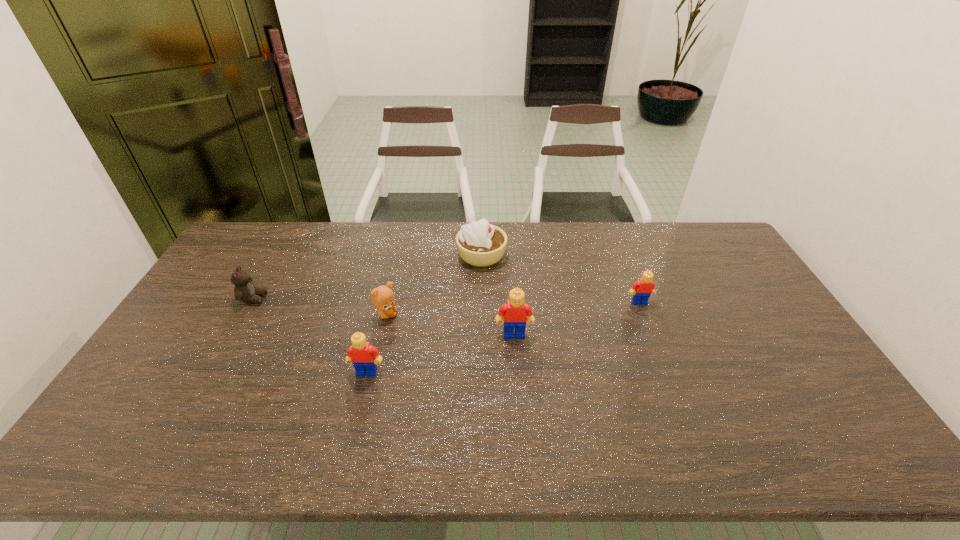
Locate an element on the screen. free area in between the left teddy bear and the whipped cream is located at coordinates (368, 276).

Where is `free area in between the left teddy bear and the rightmost Lego`? free area in between the left teddy bear and the rightmost Lego is located at coordinates (446, 300).

Where is `vacant space that's between the second nearest object and the leftmost Lego`? The width and height of the screenshot is (960, 540). vacant space that's between the second nearest object and the leftmost Lego is located at coordinates (441, 353).

Select which object is the third closest to the right teddy bear. Please provide its 2D coordinates. Your answer should be formatted as a tuple, i.e. [(x, y)], where the tuple contains the x and y coordinates of a point satisfying the conditions above.

[(515, 311)]

Point out which object is positioned as the nearest to the leftmost object. Please provide its 2D coordinates. Your answer should be formatted as a tuple, i.e. [(x, y)], where the tuple contains the x and y coordinates of a point satisfying the conditions above.

[(382, 297)]

You are a GUI agent. You are given a task and a screenshot of the screen. Output one action in this format:
    pyautogui.click(x=<x>, y=<y>)
    Task: Click on the Lego that is the nearest to the nearest object
    The width and height of the screenshot is (960, 540).
    Given the screenshot: What is the action you would take?
    pyautogui.click(x=515, y=311)

I want to click on Lego identified as the second closest to the nearest Lego, so click(642, 289).

Where is `vacant space that satisfies the following two spatial constraints: 1. on the face of the rightmost Lego; 2. on the face of the right teddy bear`? This screenshot has height=540, width=960. vacant space that satisfies the following two spatial constraints: 1. on the face of the rightmost Lego; 2. on the face of the right teddy bear is located at coordinates (644, 315).